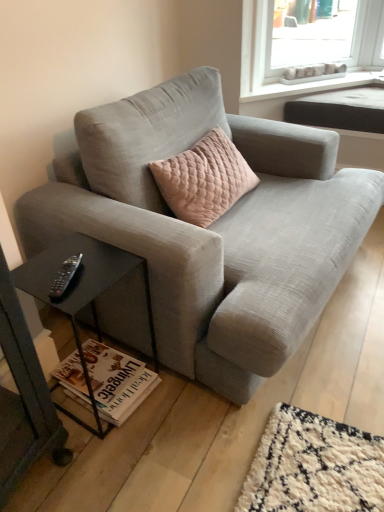
What are the coordinates of `vacant area that lies between white paper magazine at lower left and light gray fabric couch at center` in the screenshot? It's located at (157, 399).